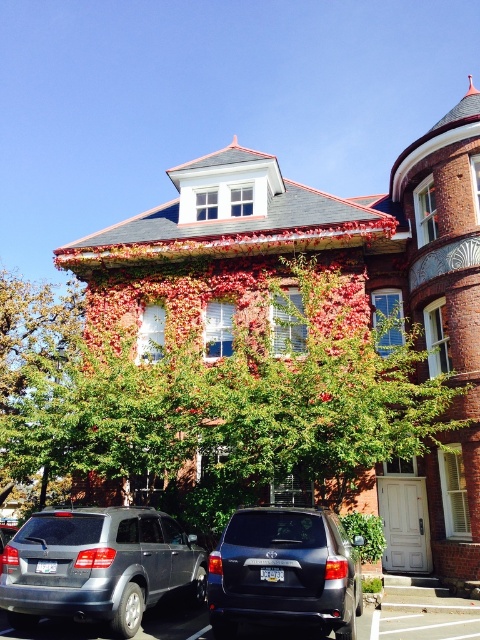
You are a delivery person trying to park your van in front of the building. The green leafy tree at center and the matte black suv at center are already there. Which one is closer to the building so you can park around it?

The green leafy tree at center is taller than the matte black suv at center, but height does not determine proximity. Since both are parked in front of the building, you need to check their positions. However, based on the given information, we cannot determine which is closer to the building.

You are a delivery driver who needs to park your truck between the green leafy tree at center and the satin gray suv at lower left. The truck is 6 meters long. Can you fit your truck in the space between them?

The green leafy tree at center is larger in size than the satin gray suv at lower left, but the description does not provide the distance between them. Therefore, it is impossible to determine if the truck can fit in the space between them.

You are a delivery person needing to park your van between the satin gray suv at lower left and the matte black suv at center. Can your van fit in the space between them if your van is 5 meters long?

The satin gray suv at lower left is larger than the matte black suv at center. However, the distance between them isn not provided in the description, so we cannot determine if the van will fit.